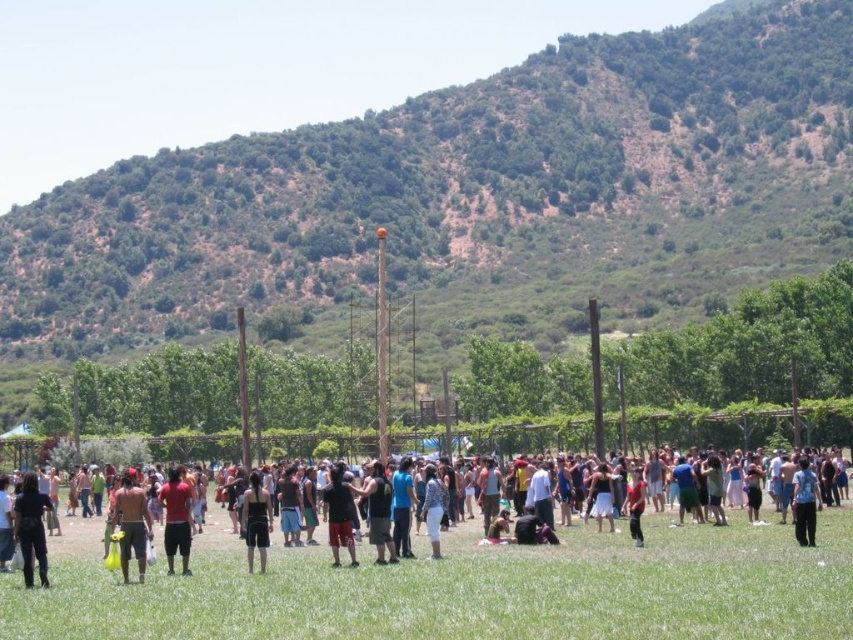
You are a photographer positioned at the back of the field. You notice two people wearing black matte pants at lower left and black matte shorts at center. Which clothing item is closer to the front of the field?

The black matte pants at lower left are closer to the front of the field because they are positioned below the black matte shorts at center in the image, indicating a lower spatial position which typically corresponds to being in front in such scenes.

You are standing at the center of the grassy field and want to locate the black matte pants at lower left. According to the coordinates provided, in which direction should you move to find them?

The black matte pants at lower left are located at point (32, 529). Since you are at the center, you should move towards the lower left direction to reach them.

You are attending an outdoor festival and notice two attendees wearing black matte pants at lower left and a black tank top at center. Which clothing item is closer to the ground?

The black matte pants at lower left is positioned under the black tank top at center, so it is closer to the ground.